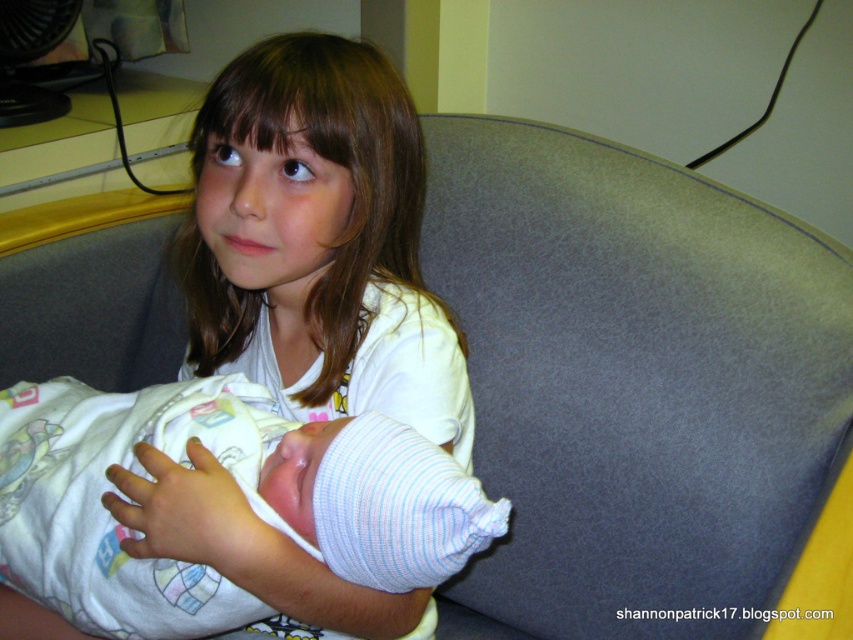
Question: Is white soft shirt at center closer to camera compared to white soft fabric newborn at center?

Choices:
 (A) yes
 (B) no

Answer: (B)

Question: Which object appears closest to the camera in this image?

Choices:
 (A) white soft fabric newborn at center
 (B) white soft fabric at center

Answer: (A)

Question: Does white soft fabric newborn at center lie behind white striped fabric at center?

Choices:
 (A) no
 (B) yes

Answer: (A)

Question: Does white soft shirt at center have a smaller size compared to white soft fabric at center?

Choices:
 (A) yes
 (B) no

Answer: (B)

Question: Which point is farther to the camera?

Choices:
 (A) (22, 445)
 (B) (234, 496)
 (C) (469, 413)
 (D) (190, 481)

Answer: (C)

Question: Which point is closer to the camera taking this photo?

Choices:
 (A) (253, 500)
 (B) (212, 221)

Answer: (A)